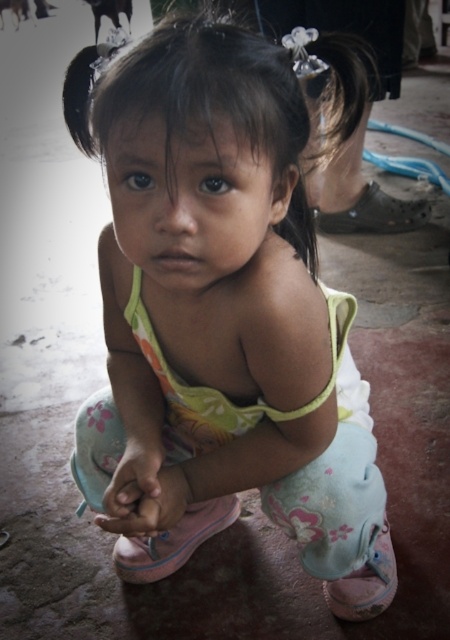
Question: Does pastel floral dress at center have a larger size compared to light pink fabric hand at center?

Choices:
 (A) no
 (B) yes

Answer: (B)

Question: Is dark brown silky hair at center thinner than pink fabric hand at center?

Choices:
 (A) no
 (B) yes

Answer: (A)

Question: Considering the real-world distances, which object is farthest from the brown textured sandal at lower right?

Choices:
 (A) pink fabric hand at center
 (B) light pink fabric hand at center
 (C) pastel floral dress at center

Answer: (B)

Question: Can you confirm if light pink fabric hand at center is positioned to the right of pink fabric hand at center?

Choices:
 (A) no
 (B) yes

Answer: (B)

Question: Which point is closer to the camera taking this photo?

Choices:
 (A) (133, 513)
 (B) (100, 120)
 (C) (116, 481)

Answer: (B)

Question: Among these points, which one is nearest to the camera?

Choices:
 (A) (381, 218)
 (B) (292, 436)
 (C) (315, 248)
 (D) (176, 504)

Answer: (B)